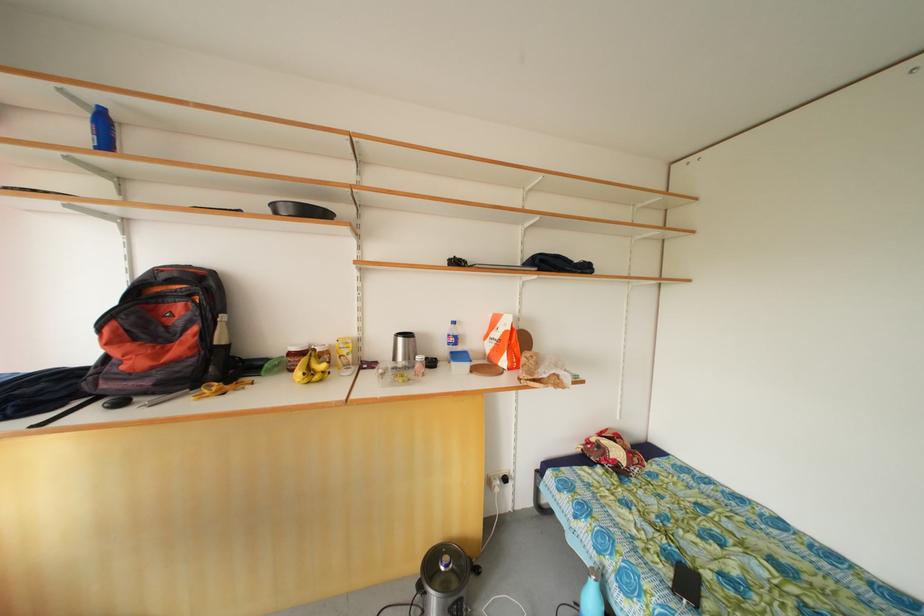
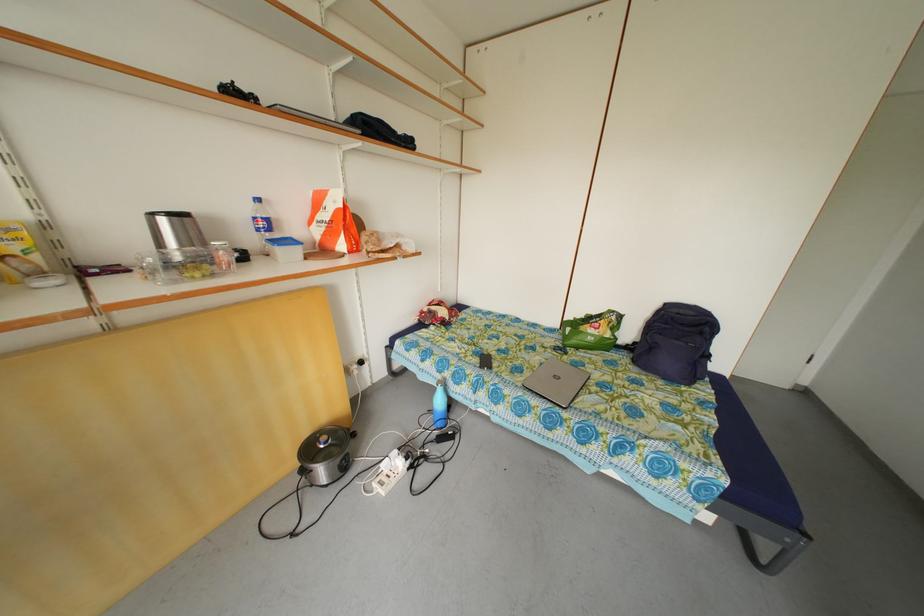
The point at (x=504, y=341) is marked in the first image. Where is the corresponding point in the second image?

(332, 222)